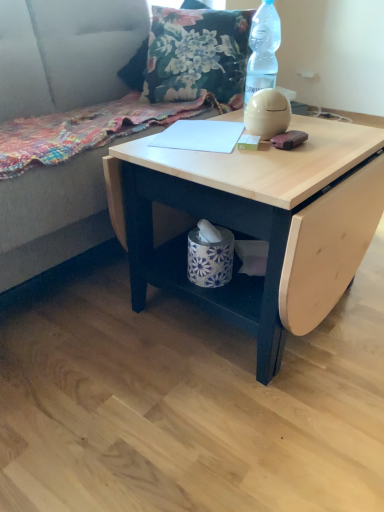
Locate an element on the screen. The image size is (384, 512). vacant area that is situated to the right of transparent plastic bottle at upper right is located at coordinates [320, 125].